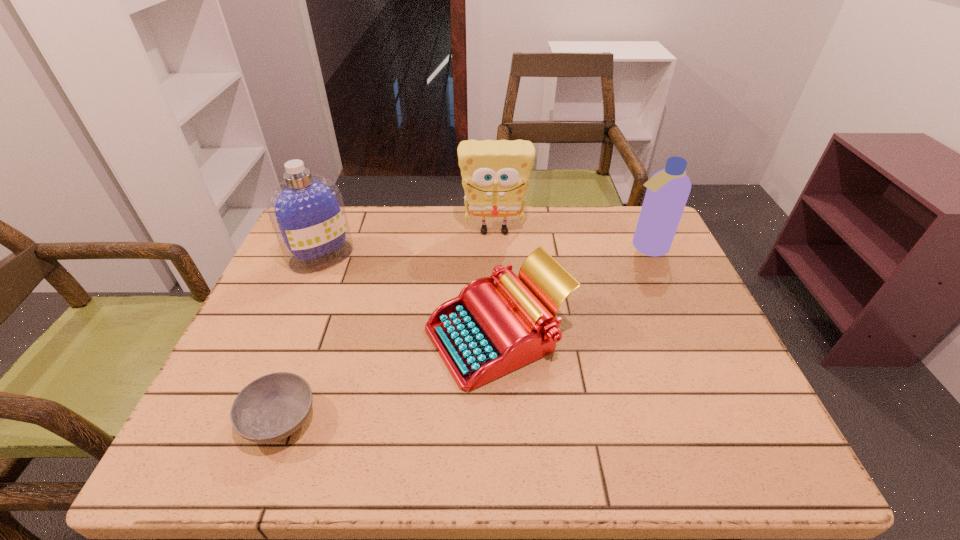
Where is `cleansing agent`? The image size is (960, 540). cleansing agent is located at coordinates pyautogui.click(x=306, y=210).

You are a GUI agent. You are given a task and a screenshot of the screen. Output one action in this format:
    pyautogui.click(x=<x>, y=<y>)
    Task: Click on the rightmost object
    This screenshot has width=960, height=540.
    Given the screenshot: What is the action you would take?
    pyautogui.click(x=667, y=192)

What are the coordinates of `sponge` in the screenshot? It's located at (495, 174).

I want to click on typewriter, so click(489, 330).

The image size is (960, 540). I want to click on bowl, so click(272, 407).

Locate an element on the screen. This screenshot has width=960, height=540. free spot located on the back of the cleansing agent is located at coordinates (340, 212).

Locate an element on the screen. This screenshot has height=540, width=960. free space located on the left of the rightmost object is located at coordinates (545, 247).

Find the location of a particular element. The width and height of the screenshot is (960, 540). free space located on the face of the sponge is located at coordinates (496, 280).

At what (x,y) coordinates should I click in order to perform the action: click on free space located 0.050m on the typing side of the second shortest object. Please return your answer as a coordinate pair (x, y). The width and height of the screenshot is (960, 540). Looking at the image, I should click on (403, 336).

In order to click on vacant space located on the typing side of the second shortest object in this screenshot , I will do `click(395, 336)`.